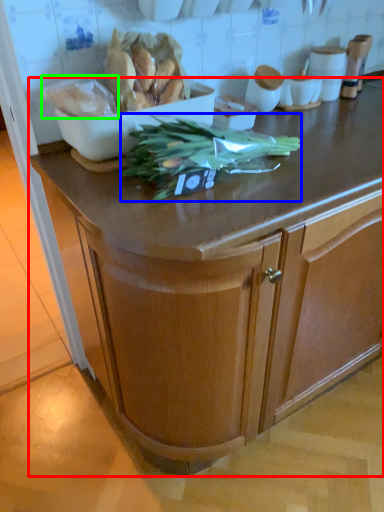
Question: Which object is positioned closest to cabinetry (highlighted by a red box)? Select from vegetable (highlighted by a blue box) and food (highlighted by a green box).

Choices:
 (A) vegetable
 (B) food

Answer: (A)